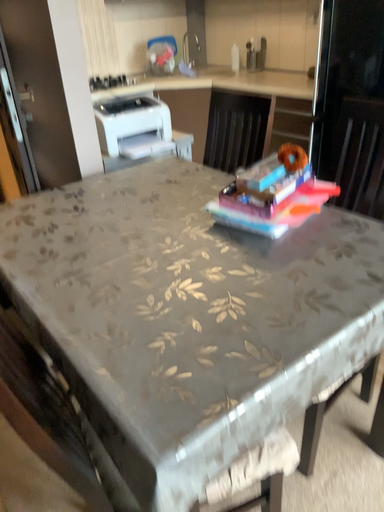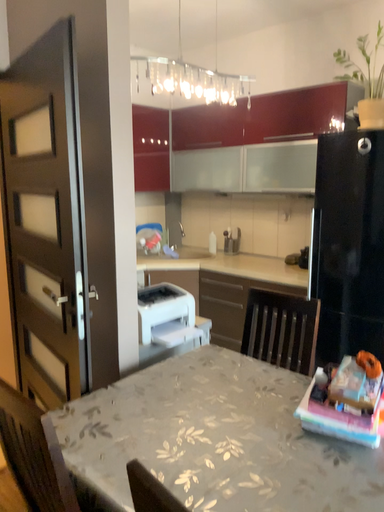
Question: Which way did the camera rotate in the video?

Choices:
 (A) rotated left
 (B) rotated right

Answer: (B)